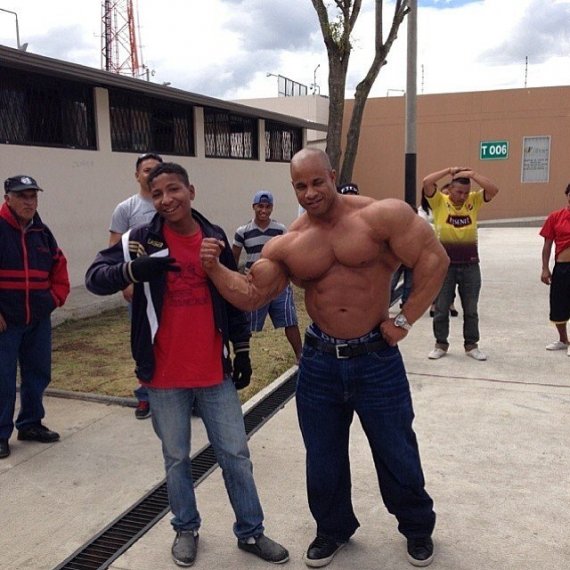
Find the location of a particular element. fan is located at coordinates (164, 268).